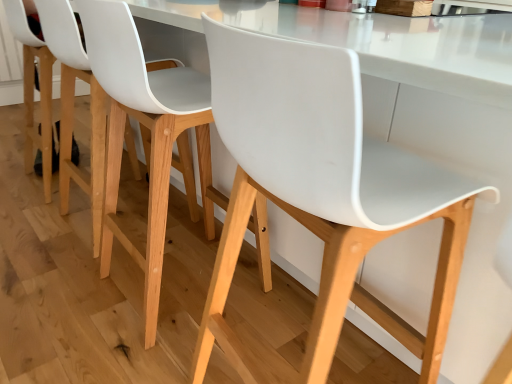
The width and height of the screenshot is (512, 384). In order to click on white plastic chair at center, acting as the 2th chair starting from the right in this screenshot , I will do `click(147, 137)`.

What do you see at coordinates (147, 137) in the screenshot? I see `white plastic chair at center, which is counted as the 1th chair, starting from the left` at bounding box center [147, 137].

Measure the distance between white plastic chair at center, which is counted as the 1th chair, starting from the left, and camera.

white plastic chair at center, which is counted as the 1th chair, starting from the left, and camera are 33.41 inches apart.

Find the location of a particular element. Image resolution: width=512 pixels, height=384 pixels. white matte plastic chair at center, which is the 1th chair in right-to-left order is located at coordinates (321, 193).

What do you see at coordinates (321, 193) in the screenshot? I see `white matte plastic chair at center, positioned as the 2th chair in left-to-right order` at bounding box center [321, 193].

Locate an element on the screen. white plastic chair at center, acting as the 2th chair starting from the right is located at coordinates (147, 137).

Can you confirm if white matte plastic chair at center, positioned as the 2th chair in left-to-right order, is positioned to the right of white plastic chair at center, acting as the 2th chair starting from the right?

Yes.

Relative to white plastic chair at center, acting as the 2th chair starting from the right, is white matte plastic chair at center, which is the 1th chair in right-to-left order, in front or behind?

Visually, white matte plastic chair at center, which is the 1th chair in right-to-left order, is located in front of white plastic chair at center, acting as the 2th chair starting from the right.

Is point (321, 66) positioned after point (149, 314)?

No, it is in front of (149, 314).

From the image's perspective, would you say white matte plastic chair at center, positioned as the 2th chair in left-to-right order, is shown under white plastic chair at center, which is counted as the 1th chair, starting from the left?

Yes, from the image's perspective, white matte plastic chair at center, positioned as the 2th chair in left-to-right order, is below white plastic chair at center, which is counted as the 1th chair, starting from the left.

From a real-world perspective, is white matte plastic chair at center, positioned as the 2th chair in left-to-right order, below white plastic chair at center, which is counted as the 1th chair, starting from the left?

No.

Considering the sizes of objects white matte plastic chair at center, which is the 1th chair in right-to-left order, and white plastic chair at center, which is counted as the 1th chair, starting from the left, in the image provided, who is thinner, white matte plastic chair at center, which is the 1th chair in right-to-left order, or white plastic chair at center, which is counted as the 1th chair, starting from the left,?

white plastic chair at center, which is counted as the 1th chair, starting from the left.

Who is shorter, white matte plastic chair at center, which is the 1th chair in right-to-left order, or white plastic chair at center, which is counted as the 1th chair, starting from the left?

With less height is white plastic chair at center, which is counted as the 1th chair, starting from the left.

Looking at the image, does white matte plastic chair at center, which is the 1th chair in right-to-left order, seem bigger or smaller compared to white plastic chair at center, acting as the 2th chair starting from the right?

Considering their sizes, white matte plastic chair at center, which is the 1th chair in right-to-left order, takes up less space than white plastic chair at center, acting as the 2th chair starting from the right.

Is white matte plastic chair at center, positioned as the 2th chair in left-to-right order, inside the boundaries of white plastic chair at center, acting as the 2th chair starting from the right, or outside?

white matte plastic chair at center, positioned as the 2th chair in left-to-right order, is not inside white plastic chair at center, acting as the 2th chair starting from the right, it's outside.

Are white matte plastic chair at center, positioned as the 2th chair in left-to-right order, and white plastic chair at center, which is counted as the 1th chair, starting from the left, located far from each other?

Actually, white matte plastic chair at center, positioned as the 2th chair in left-to-right order, and white plastic chair at center, which is counted as the 1th chair, starting from the left, are a little close together.

Does white matte plastic chair at center, positioned as the 2th chair in left-to-right order, turn towards white plastic chair at center, which is counted as the 1th chair, starting from the left?

No, white matte plastic chair at center, positioned as the 2th chair in left-to-right order, is not facing towards white plastic chair at center, which is counted as the 1th chair, starting from the left.

Where is `chair on the left of white matte plastic chair at center, which is the 1th chair in right-to-left order`? This screenshot has height=384, width=512. chair on the left of white matte plastic chair at center, which is the 1th chair in right-to-left order is located at coordinates (147, 137).

From the picture: Which is more to the left, white plastic chair at center, acting as the 2th chair starting from the right, or white matte plastic chair at center, which is the 1th chair in right-to-left order?

From the viewer's perspective, white plastic chair at center, acting as the 2th chair starting from the right, appears more on the left side.

Is white plastic chair at center, acting as the 2th chair starting from the right, in front of white matte plastic chair at center, positioned as the 2th chair in left-to-right order?

No, white plastic chair at center, acting as the 2th chair starting from the right, is further to the viewer.

Considering the points (207, 195) and (195, 369), which point is behind, point (207, 195) or point (195, 369)?

The point (207, 195) is farther.

From the image's perspective, relative to white matte plastic chair at center, which is the 1th chair in right-to-left order, is white plastic chair at center, acting as the 2th chair starting from the right, above or below?

white plastic chair at center, acting as the 2th chair starting from the right, is above white matte plastic chair at center, which is the 1th chair in right-to-left order.

From the picture: From a real-world perspective, is white plastic chair at center, which is counted as the 1th chair, starting from the left, positioned above or below white matte plastic chair at center, which is the 1th chair in right-to-left order?

In terms of real-world spatial position, white plastic chair at center, which is counted as the 1th chair, starting from the left, is below white matte plastic chair at center, which is the 1th chair in right-to-left order.

Consider the image. Considering the relative sizes of white plastic chair at center, which is counted as the 1th chair, starting from the left, and white matte plastic chair at center, which is the 1th chair in right-to-left order, in the image provided, is white plastic chair at center, which is counted as the 1th chair, starting from the left, thinner than white matte plastic chair at center, which is the 1th chair in right-to-left order,?

Yes, white plastic chair at center, which is counted as the 1th chair, starting from the left, is thinner than white matte plastic chair at center, which is the 1th chair in right-to-left order.

Is white plastic chair at center, acting as the 2th chair starting from the right, shorter than white matte plastic chair at center, positioned as the 2th chair in left-to-right order?

Correct, white plastic chair at center, acting as the 2th chair starting from the right, is not as tall as white matte plastic chair at center, positioned as the 2th chair in left-to-right order.

Which of these two, white plastic chair at center, which is counted as the 1th chair, starting from the left, or white matte plastic chair at center, which is the 1th chair in right-to-left order, is bigger?

Bigger between the two is white plastic chair at center, which is counted as the 1th chair, starting from the left.

Do you think white plastic chair at center, acting as the 2th chair starting from the right, is within white matte plastic chair at center, positioned as the 2th chair in left-to-right order, or outside of it?

white plastic chair at center, acting as the 2th chair starting from the right, cannot be found inside white matte plastic chair at center, positioned as the 2th chair in left-to-right order.

Is white plastic chair at center, acting as the 2th chair starting from the right, next to white matte plastic chair at center, which is the 1th chair in right-to-left order?

They are not placed beside each other.

Is white plastic chair at center, acting as the 2th chair starting from the right, positioned with its back to white matte plastic chair at center, positioned as the 2th chair in left-to-right order?

No, white matte plastic chair at center, positioned as the 2th chair in left-to-right order, is not at the back of white plastic chair at center, acting as the 2th chair starting from the right.

How different are the orientations of white plastic chair at center, acting as the 2th chair starting from the right, and white matte plastic chair at center, positioned as the 2th chair in left-to-right order, in degrees?

6.63 degrees separate the facing orientations of white plastic chair at center, acting as the 2th chair starting from the right, and white matte plastic chair at center, positioned as the 2th chair in left-to-right order.

Measure the distance between white plastic chair at center, acting as the 2th chair starting from the right, and white matte plastic chair at center, which is the 1th chair in right-to-left order.

47.57 centimeters.

At what (x,y) coordinates should I click in order to perform the action: click on chair that appears below the white plastic chair at center, which is counted as the 1th chair, starting from the left (from the image's perspective). Please return your answer as a coordinate pair (x, y). This screenshot has height=384, width=512. Looking at the image, I should click on (321, 193).

The width and height of the screenshot is (512, 384). What are the coordinates of `chair above the white plastic chair at center, acting as the 2th chair starting from the right (from a real-world perspective)` in the screenshot? It's located at (321, 193).

The image size is (512, 384). In order to click on chair below the white plastic chair at center, which is counted as the 1th chair, starting from the left (from the image's perspective) in this screenshot , I will do `click(321, 193)`.